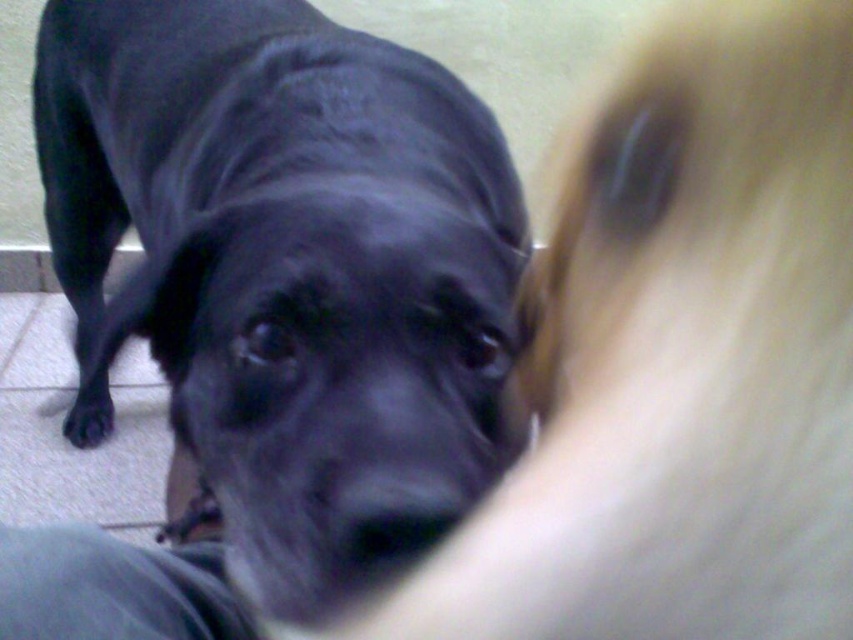
From the picture: Does black smooth dog at center have a lesser width compared to black matte paw at lower left?

Incorrect, black smooth dog at center's width is not less than black matte paw at lower left's.

Does point (250, 419) lie behind point (84, 442)?

No, it is in front of (84, 442).

Between point (302, 531) and point (93, 420), which one is positioned in front?

Point (302, 531)

What are the coordinates of `black smooth dog at center` in the screenshot? It's located at (289, 269).

Is black smooth dog at center closer to camera compared to gray fabric at lower left?

Yes, black smooth dog at center is closer to the viewer.

Does black smooth dog at center have a lesser height compared to gray fabric at lower left?

In fact, black smooth dog at center may be taller than gray fabric at lower left.

Which is in front, point (466, 352) or point (76, 588)?

Positioned in front is point (76, 588).

The image size is (853, 640). Identify the location of black smooth dog at center. (289, 269).

Can you confirm if gray fabric at lower left is wider than black matte paw at lower left?

Correct, the width of gray fabric at lower left exceeds that of black matte paw at lower left.

Which is in front, point (114, 566) or point (96, 442)?

Positioned in front is point (114, 566).

Measure the distance between gray fabric at lower left and camera.

gray fabric at lower left and camera are 13.31 inches apart.

You are a GUI agent. You are given a task and a screenshot of the screen. Output one action in this format:
    pyautogui.click(x=<x>, y=<y>)
    Task: Click on the gray fabric at lower left
    
    Given the screenshot: What is the action you would take?
    pyautogui.click(x=112, y=588)